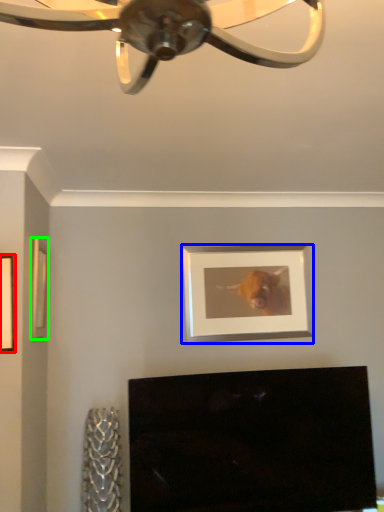
Question: Which object is the closest to the picture frame (highlighted by a red box)? Choose among these: picture frame (highlighted by a blue box) or picture frame (highlighted by a green box).

Choices:
 (A) picture frame
 (B) picture frame

Answer: (B)